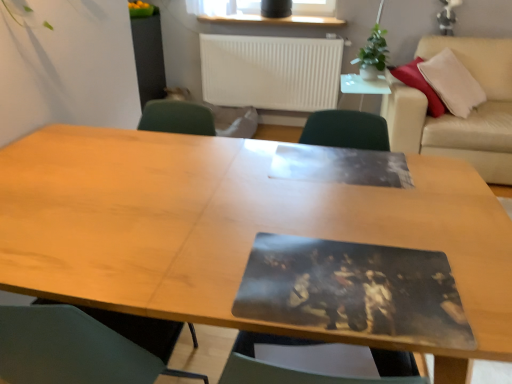
What do you see at coordinates (271, 72) in the screenshot? This screenshot has height=384, width=512. I see `white matte radiator at upper center` at bounding box center [271, 72].

Measure the distance between green leafy plant at upper right and camera.

green leafy plant at upper right and camera are 9.68 feet apart from each other.

Describe the element at coordinates (458, 117) in the screenshot. I see `beige leather couch at upper right` at that location.

Locate an element on the screen. The width and height of the screenshot is (512, 384). white glossy side table at upper center is located at coordinates (362, 86).

Where is `white matte radiator at upper center`? This screenshot has height=384, width=512. white matte radiator at upper center is located at coordinates (271, 72).

From a real-world perspective, which object rests below the other?

In real-world perspective, wooden table at center is lower.

Can you tell me how much green leafy plant at upper right and wooden table at center differ in facing direction?

green leafy plant at upper right and wooden table at center are facing 179 degrees away from each other.

Is green leafy plant at upper right turned away from wooden table at center?

No, green leafy plant at upper right's orientation is not away from wooden table at center.

Is white matte radiator at upper center touching beige leather couch at upper right?

No.

From a real-world perspective, which is physically below, white matte radiator at upper center or beige leather couch at upper right?

beige leather couch at upper right.

Can you tell me how much white matte radiator at upper center and beige leather couch at upper right differ in facing direction?

0.0986 degrees.

Can beige leather couch at upper right be found inside white matte radiator at upper center?

No, beige leather couch at upper right is not surrounded by white matte radiator at upper center.

Is there a large distance between green leafy plant at upper right and white matte radiator at upper center?

green leafy plant at upper right is actually quite close to white matte radiator at upper center.

Is white matte radiator at upper center at the back of green leafy plant at upper right?

No.

Is green leafy plant at upper right at the left side of white matte radiator at upper center?

Incorrect, green leafy plant at upper right is not on the left side of white matte radiator at upper center.

Is green leafy plant at upper right wider or thinner than white matte radiator at upper center?

Clearly, green leafy plant at upper right has more width compared to white matte radiator at upper center.

How much distance is there between wooden table at center and white matte radiator at upper center?

A distance of 2.48 meters exists between wooden table at center and white matte radiator at upper center.

Is wooden table at center situated inside white matte radiator at upper center or outside?

wooden table at center is outside white matte radiator at upper center.

Is wooden table at center wider or thinner than white matte radiator at upper center?

wooden table at center is wider than white matte radiator at upper center.

The width and height of the screenshot is (512, 384). In order to click on radiator above the wooden table at center (from the image's perspective) in this screenshot , I will do `click(271, 72)`.

Can you tell me how much green leafy plant at upper right and white glossy side table at upper center differ in facing direction?

There is a 0.349-degree angle between the facing directions of green leafy plant at upper right and white glossy side table at upper center.

Can you confirm if green leafy plant at upper right is taller than white glossy side table at upper center?

Yes.

Is green leafy plant at upper right looking in the opposite direction of white glossy side table at upper center?

No, green leafy plant at upper right is not facing away from white glossy side table at upper center.

Is point (381, 36) farther from viewer compared to point (380, 85)?

Yes.

Does beige leather couch at upper right turn towards green leafy plant at upper right?

No, beige leather couch at upper right does not turn towards green leafy plant at upper right.

Between point (394, 96) and point (362, 66), which one is positioned in front?

The point (394, 96) is closer.

Considering the sizes of objects beige leather couch at upper right and green leafy plant at upper right in the image provided, who is bigger, beige leather couch at upper right or green leafy plant at upper right?

With larger size is beige leather couch at upper right.

From the image's perspective, is beige leather couch at upper right on green leafy plant at upper right?

No, from the image's perspective, beige leather couch at upper right is not over green leafy plant at upper right.

Is white glossy side table at upper center facing towards white matte radiator at upper center?

No, white glossy side table at upper center is not aimed at white matte radiator at upper center.

Is white glossy side table at upper center with white matte radiator at upper center?

white glossy side table at upper center and white matte radiator at upper center are not in contact.

Is point (375, 87) farther from camera compared to point (286, 74)?

That is False.

The height and width of the screenshot is (384, 512). I want to click on table directly beneath the green leafy plant at upper right (from a real-world perspective), so click(x=229, y=228).

Where is `couch that is in front of the white matte radiator at upper center`? The height and width of the screenshot is (384, 512). couch that is in front of the white matte radiator at upper center is located at coordinates (458, 117).

When comparing their distances from white matte radiator at upper center, does white glossy side table at upper center or beige leather couch at upper right seem closer?

white glossy side table at upper center lies closer to white matte radiator at upper center than the other object.

Estimate the real-world distances between objects in this image. Which object is further from white glossy side table at upper center, white matte radiator at upper center or green leafy plant at upper right?

Among the two, white matte radiator at upper center is located further to white glossy side table at upper center.

Estimate the real-world distances between objects in this image. Which object is further from beige leather couch at upper right, white matte radiator at upper center or green leafy plant at upper right?

Among the two, white matte radiator at upper center is located further to beige leather couch at upper right.

Estimate the real-world distances between objects in this image. Which object is further from beige leather couch at upper right, green leafy plant at upper right or wooden table at center?

wooden table at center.

Based on their spatial positions, is white matte radiator at upper center or white glossy side table at upper center closer to green leafy plant at upper right?

The object closer to green leafy plant at upper right is white glossy side table at upper center.

Looking at the image, which one is located further to white glossy side table at upper center, green leafy plant at upper right or wooden table at center?

wooden table at center is further to white glossy side table at upper center.

Considering their positions, is beige leather couch at upper right positioned closer to green leafy plant at upper right than wooden table at center?

Based on the image, beige leather couch at upper right appears to be nearer to green leafy plant at upper right.

Estimate the real-world distances between objects in this image. Which object is closer to white matte radiator at upper center, green leafy plant at upper right or beige leather couch at upper right?

green leafy plant at upper right lies closer to white matte radiator at upper center than the other object.

Where is `plant positioned between wooden table at center and white matte radiator at upper center from near to far`? This screenshot has height=384, width=512. plant positioned between wooden table at center and white matte radiator at upper center from near to far is located at coordinates (x=374, y=50).

Find the location of `side table located between white matte radiator at upper center and beige leather couch at upper right in the left-right direction`. side table located between white matte radiator at upper center and beige leather couch at upper right in the left-right direction is located at coordinates (362, 86).

This screenshot has width=512, height=384. I want to click on side table between wooden table at center and green leafy plant at upper right in the front-back direction, so click(362, 86).

Locate an element on the screen. The height and width of the screenshot is (384, 512). couch located between wooden table at center and green leafy plant at upper right in the depth direction is located at coordinates (458, 117).